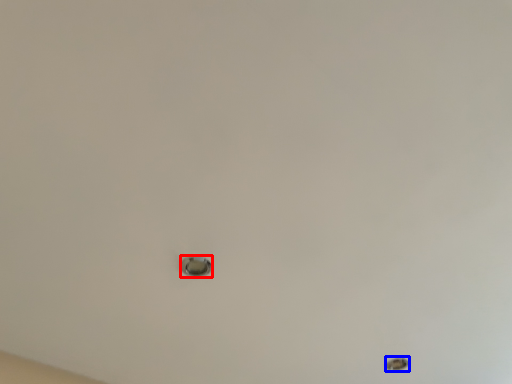
Question: Which object is further to the camera taking this photo, knob (highlighted by a red box) or hole (highlighted by a blue box)?

Choices:
 (A) knob
 (B) hole

Answer: (B)